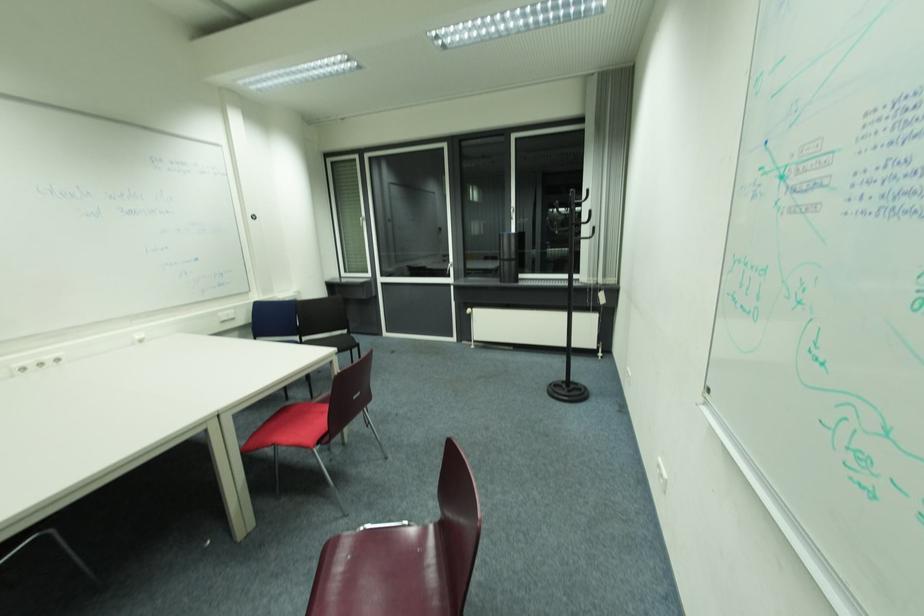
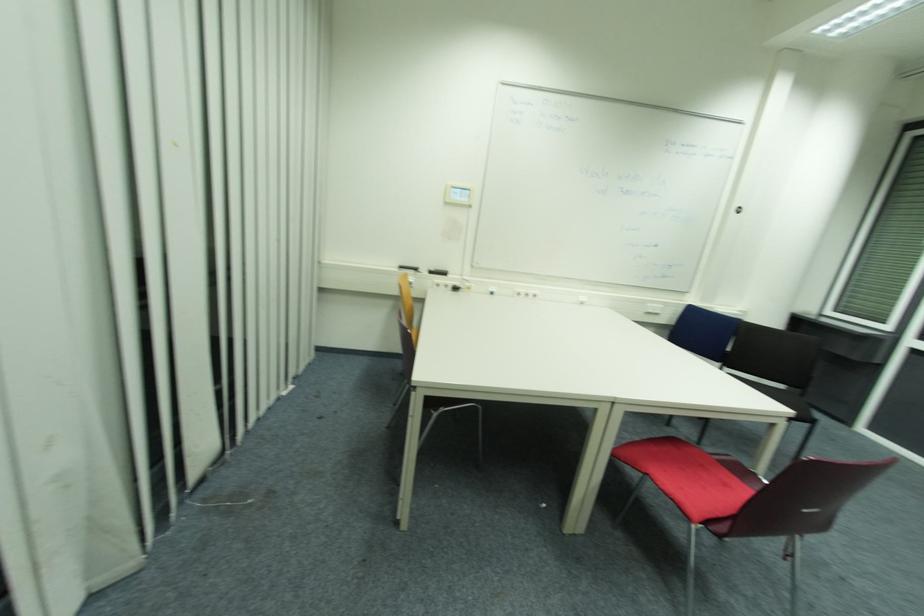
Question: The camera is either moving clockwise (left) or counter-clockwise (right) around the object. The first image is from the beginning of the video and the second image is from the end. Is the camera moving left or right when shooting the video?

Choices:
 (A) Left
 (B) Right

Answer: (B)